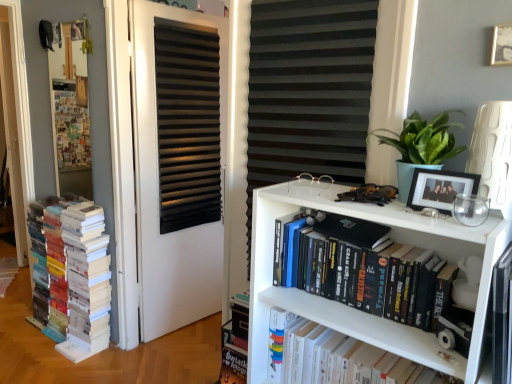
Question: From the image's perspective, is multicolored paper books at left, arranged as the 3th book when viewed from the right, beneath white matte bookshelf at center, which ranks as the first book in front-to-back order?

Choices:
 (A) yes
 (B) no

Answer: (B)

Question: Is multicolored paper books at left, arranged as the 3th book when viewed from the right, positioned before white matte bookshelf at center, arranged as the 3th book when viewed from the left?

Choices:
 (A) yes
 (B) no

Answer: (B)

Question: Is multicolored paper books at left, the 1th book in the back-to-front sequence, looking in the opposite direction of white matte bookshelf at center, the third book positioned from the back?

Choices:
 (A) yes
 (B) no

Answer: (B)

Question: From a real-world perspective, is multicolored paper books at left, arranged as the 3th book when viewed from the right, located higher than white matte bookshelf at center, which ranks as the first book in front-to-back order?

Choices:
 (A) no
 (B) yes

Answer: (A)

Question: From a real-world perspective, does multicolored paper books at left, which is the first book in left-to-right order, sit lower than white matte bookshelf at center, arranged as the 3th book when viewed from the left?

Choices:
 (A) yes
 (B) no

Answer: (A)

Question: From a real-world perspective, is black matte shutter at center physically located above or below wooden bulletin board at left?

Choices:
 (A) above
 (B) below

Answer: (B)

Question: From the image's perspective, relative to wooden bulletin board at left, is black matte shutter at center above or below?

Choices:
 (A) above
 (B) below

Answer: (B)

Question: From their relative heights in the image, would you say black matte shutter at center is taller or shorter than wooden bulletin board at left?

Choices:
 (A) tall
 (B) short

Answer: (A)

Question: Based on their positions, is black matte shutter at center located to the left or right of wooden bulletin board at left?

Choices:
 (A) right
 (B) left

Answer: (A)

Question: In terms of height, does multicolored paper books at left, which is the first book in left-to-right order, look taller or shorter compared to black matte door at center?

Choices:
 (A) short
 (B) tall

Answer: (A)

Question: From a real-world perspective, relative to black matte door at center, is multicolored paper books at left, positioned as the third book in front-to-back order, vertically above or below?

Choices:
 (A) below
 (B) above

Answer: (A)

Question: Choose the correct answer: Is multicolored paper books at left, arranged as the 3th book when viewed from the right, inside black matte door at center or outside it?

Choices:
 (A) inside
 (B) outside

Answer: (B)

Question: Is multicolored paper books at left, the 1th book in the back-to-front sequence, bigger or smaller than black matte door at center?

Choices:
 (A) small
 (B) big

Answer: (B)

Question: From a real-world perspective, relative to black matte picture frame at upper right, the 2th picture frame in the top-to-bottom sequence, is black matte door at center vertically above or below?

Choices:
 (A) above
 (B) below

Answer: (B)

Question: Is black matte door at center spatially inside black matte picture frame at upper right, the 1th picture frame in the left-to-right sequence, or outside of it?

Choices:
 (A) inside
 (B) outside

Answer: (B)